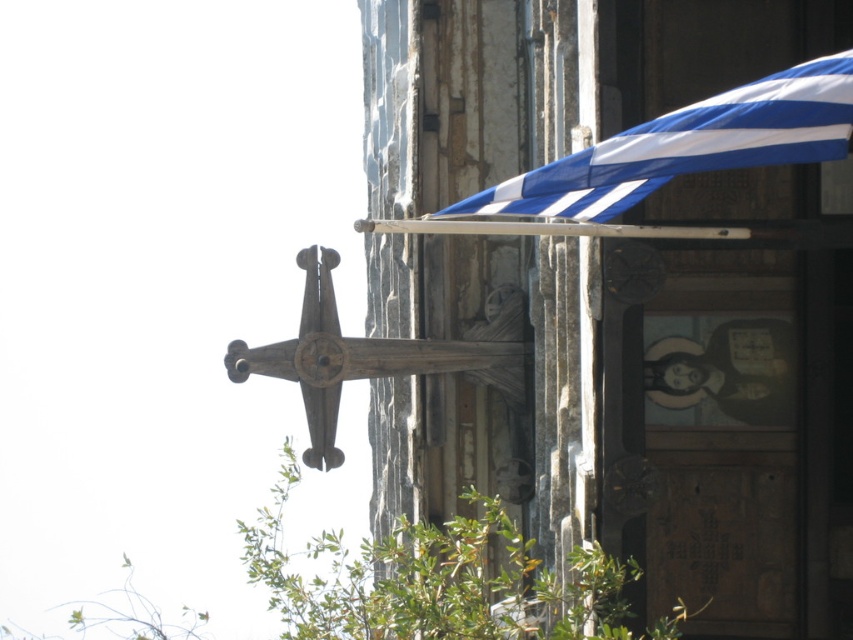
Measure the distance between blue striped awning at upper right and wooden cross at center.

They are 23.27 meters apart.

Between blue striped awning at upper right and wooden cross at center, which one has less height?

Standing shorter between the two is blue striped awning at upper right.

The width and height of the screenshot is (853, 640). I want to click on blue striped awning at upper right, so click(x=686, y=147).